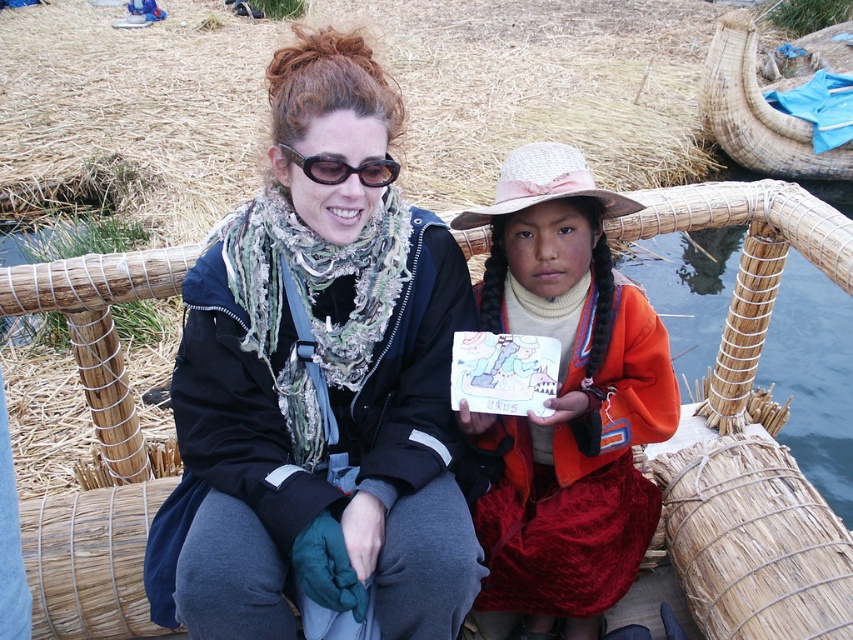
Who is lower down, woven straw boat at center or black plastic sunglasses at upper center?

woven straw boat at center is below.

Does point (96, 376) come behind point (364, 161)?

That is True.

The image size is (853, 640). Describe the element at coordinates (100, 332) in the screenshot. I see `woven straw boat at center` at that location.

Locate an element on the screen. This screenshot has height=640, width=853. woven straw boat at center is located at coordinates (100, 332).

Which is below, matte black jacket at center or velvet orange dress at center?

velvet orange dress at center

Does matte black jacket at center lie in front of velvet orange dress at center?

Yes.

What do you see at coordinates (318, 387) in the screenshot?
I see `matte black jacket at center` at bounding box center [318, 387].

Where is `matte black jacket at center`? The height and width of the screenshot is (640, 853). matte black jacket at center is located at coordinates (318, 387).

Is point (271, 364) positioned before point (375, 177)?

No, it is behind (375, 177).

Does point (296, 408) come farther from viewer compared to point (320, 160)?

Yes, it is behind point (320, 160).

Image resolution: width=853 pixels, height=640 pixels. What are the coordinates of `matte black jacket at center` in the screenshot? It's located at coord(318,387).